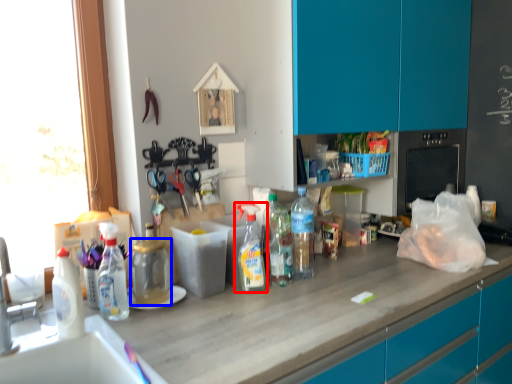
Question: Among these objects, which one is farthest to the camera, bottle (highlighted by a red box) or bottle (highlighted by a blue box)?

Choices:
 (A) bottle
 (B) bottle

Answer: (A)